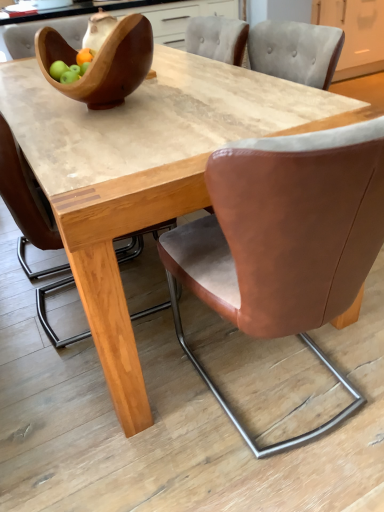
Where is `vacant space in front of wooden bowl at upper left`? The width and height of the screenshot is (384, 512). vacant space in front of wooden bowl at upper left is located at coordinates (113, 134).